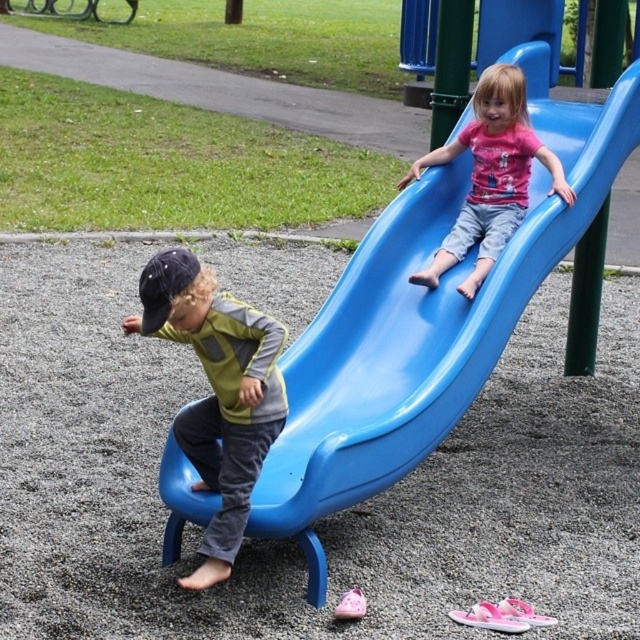
Between glossy plastic slide at upper right and matte green vest at center, which one appears on the right side from the viewer's perspective?

glossy plastic slide at upper right

Is glossy plastic slide at upper right to the left of matte green vest at center from the viewer's perspective?

In fact, glossy plastic slide at upper right is to the right of matte green vest at center.

This screenshot has width=640, height=640. I want to click on glossy plastic slide at upper right, so click(426, 316).

From the picture: Can you confirm if matte green vest at center is thinner than matte pink shirt at upper center?

Indeed, matte green vest at center has a lesser width compared to matte pink shirt at upper center.

Does point (179, 273) come in front of point (548, 160)?

That is True.

Locate an element on the screen. matte green vest at center is located at coordinates (218, 392).

Does glossy plastic slide at upper right lie behind matte pink shirt at upper center?

No.

Who is shorter, glossy plastic slide at upper right or matte pink shirt at upper center?

Standing shorter between the two is matte pink shirt at upper center.

Does point (465, 339) come closer to viewer compared to point (509, 152)?

Yes, point (465, 339) is in front of point (509, 152).

This screenshot has height=640, width=640. In order to click on glossy plastic slide at upper right in this screenshot , I will do `click(426, 316)`.